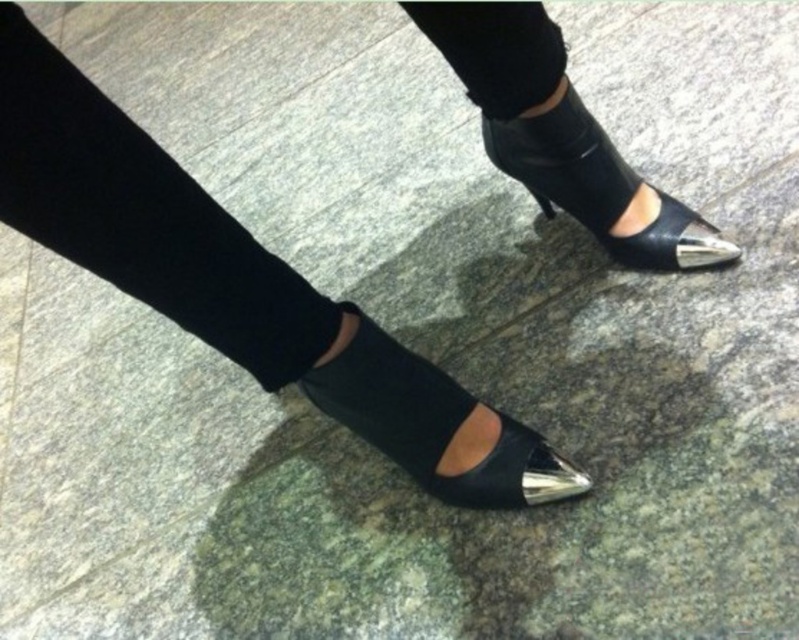
You are a photographer setting up a shoot and need to position two footwear items for a product photo. You have the black suede ankle boots at lower center and the matte black sandal at lower center. According to the scene, which footwear item is positioned to the left?

The black suede ankle boots at lower center is to the left of the matte black sandal at lower center, so the black suede ankle boots at lower center is positioned to the left.

You are a photographer trying to capture the details of both the black leather shoes at center and the black suede ankle boots at lower center. Since you can only focus on one object at a time, which one should you choose to ensure the other remains in the background?

You should focus on the black leather shoes at center because it is closer to the viewer, making the black suede ankle boots at lower center naturally appear in the background.

You are a photographer setting up a shoot. You need to ensure that the black suede ankle boots at lower center and the matte black sandal at lower center are both in focus. Given that your camera can only focus on objects at a single distance, which object should you focus on to ensure both are in focus?

You should focus on the black suede ankle boots at lower center because it is closer to the viewer than the matte black sandal at lower center. By focusing on the closer object, the farther object will still be within the depth of field, ensuring both are in focus.